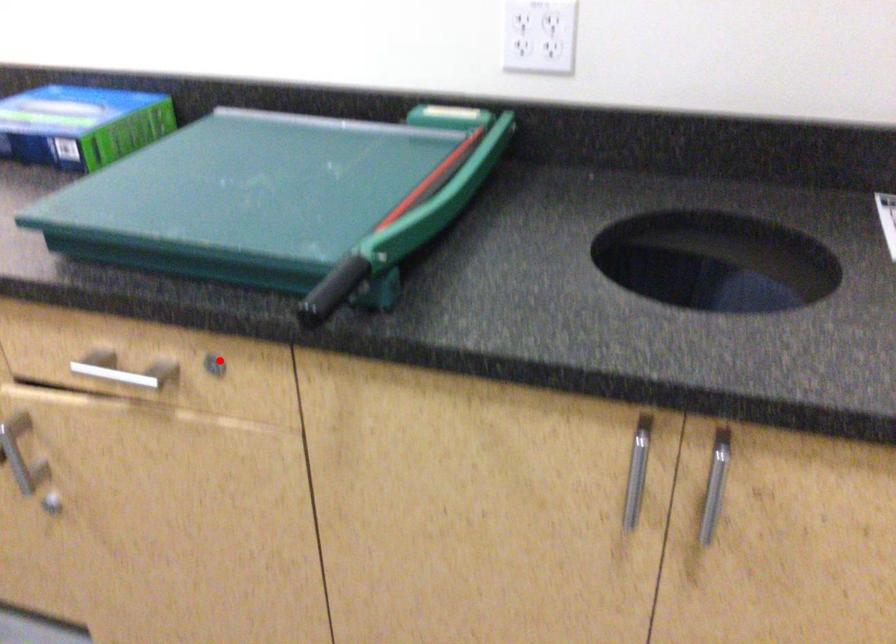
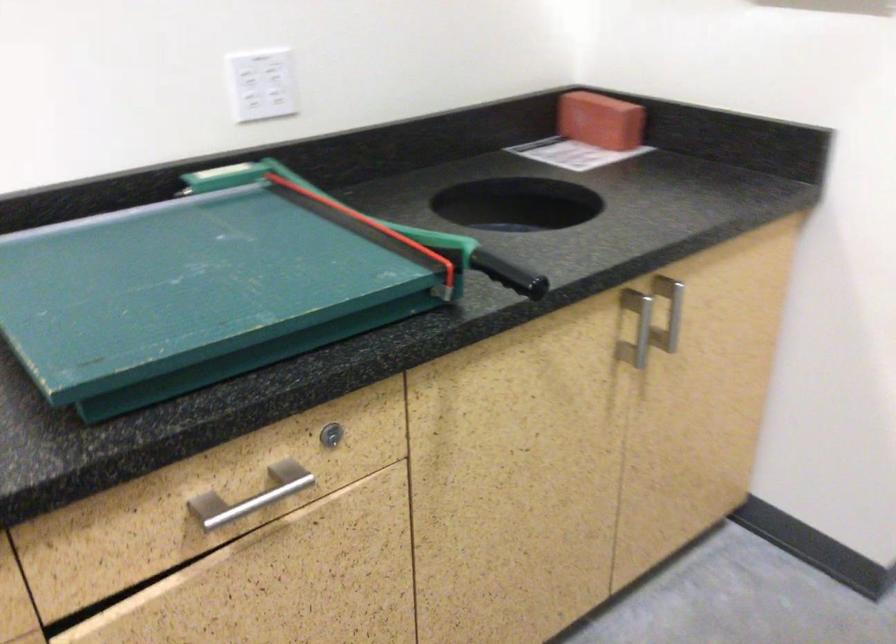
Find the pixel in the second image that matches the highlighted location in the first image.

(331, 435)